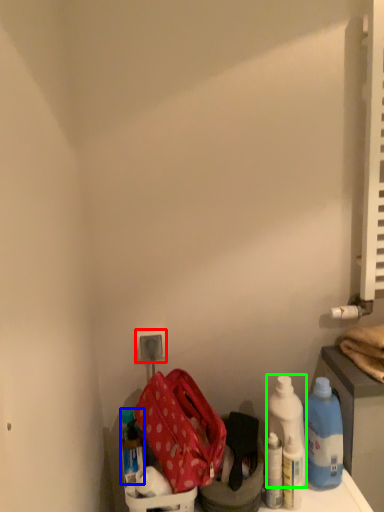
Question: Based on their relative distances, which object is nearer to electric outlet (highlighted by a red box)? Choose from bottle (highlighted by a blue box) and cleaning product (highlighted by a green box).

Choices:
 (A) bottle
 (B) cleaning product

Answer: (A)